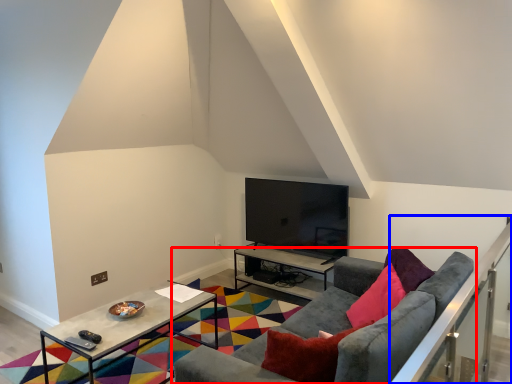
Question: Which point is further to the camera, studio couch (highlighted by a red box) or balustrade (highlighted by a blue box)?

Choices:
 (A) studio couch
 (B) balustrade

Answer: (A)